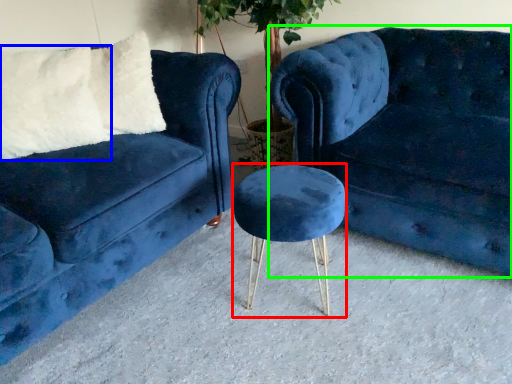
Question: Which is nearer to the bar stool (highlighted by a red box)? pillow (highlighted by a blue box) or studio couch (highlighted by a green box).

Choices:
 (A) pillow
 (B) studio couch

Answer: (B)